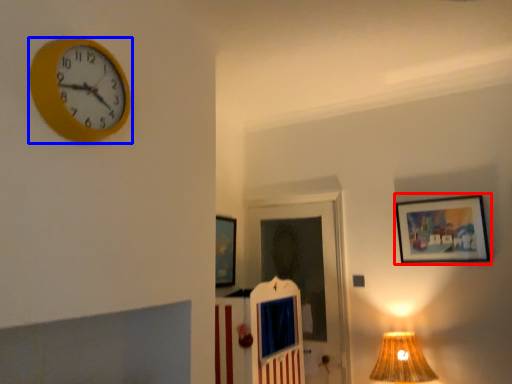
Question: Which of the following is the closest to the observer, picture frame (highlighted by a red box) or wall clock (highlighted by a blue box)?

Choices:
 (A) picture frame
 (B) wall clock

Answer: (B)